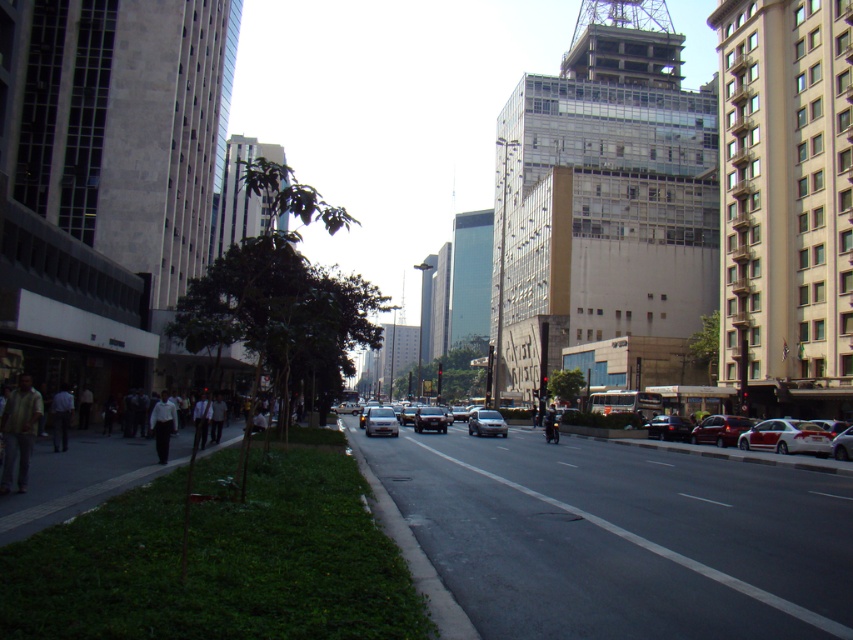
Can you confirm if dark gray clothing at left is bigger than satin silver sedan at center?

Correct, dark gray clothing at left is larger in size than satin silver sedan at center.

Is dark gray clothing at left taller than satin silver sedan at center?

Correct, dark gray clothing at left is much taller as satin silver sedan at center.

Where is `dark gray clothing at left`? The width and height of the screenshot is (853, 640). dark gray clothing at left is located at coordinates (79, 461).

Is the position of dark gray clothing at left more distant than that of white glossy car at lower right?

No, dark gray clothing at left is closer to the viewer.

What do you see at coordinates (79, 461) in the screenshot? This screenshot has width=853, height=640. I see `dark gray clothing at left` at bounding box center [79, 461].

The image size is (853, 640). I want to click on dark gray clothing at left, so click(x=79, y=461).

Who is positioned more to the right, dark gray clothing at left or shiny silver sedan at center?

shiny silver sedan at center

Which is below, dark gray clothing at left or shiny silver sedan at center?

shiny silver sedan at center is lower down.

Is point (231, 432) farther from viewer compared to point (677, 419)?

No, (231, 432) is closer to viewer.

Identify the location of dark gray clothing at left. (79, 461).